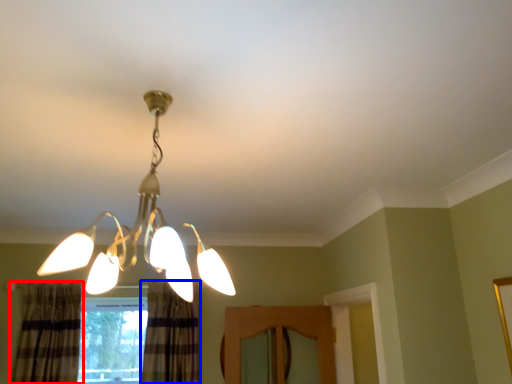
Question: Among these objects, which one is farthest to the camera, curtain (highlighted by a red box) or curtain (highlighted by a blue box)?

Choices:
 (A) curtain
 (B) curtain

Answer: (B)